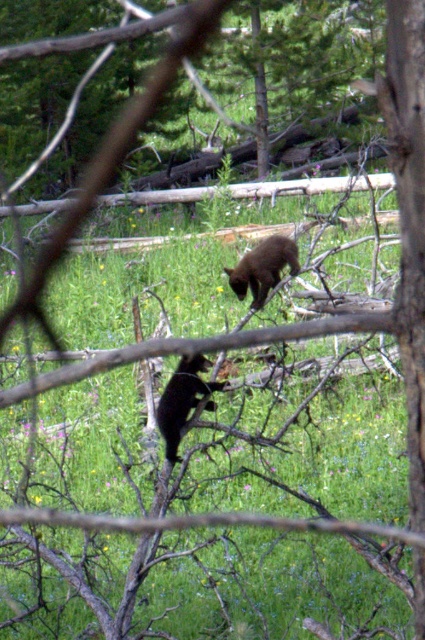
You are a wildlife photographer aiming to capture a photo of both the black furry bear at center and the shiny black bear at center. Since you want to highlight their size difference, which bear should you focus on first to ensure it appears larger in the photo?

The black furry bear at center is taller than the shiny black bear at center, so focusing on the black furry bear at center first will ensure it appears larger in the photo.